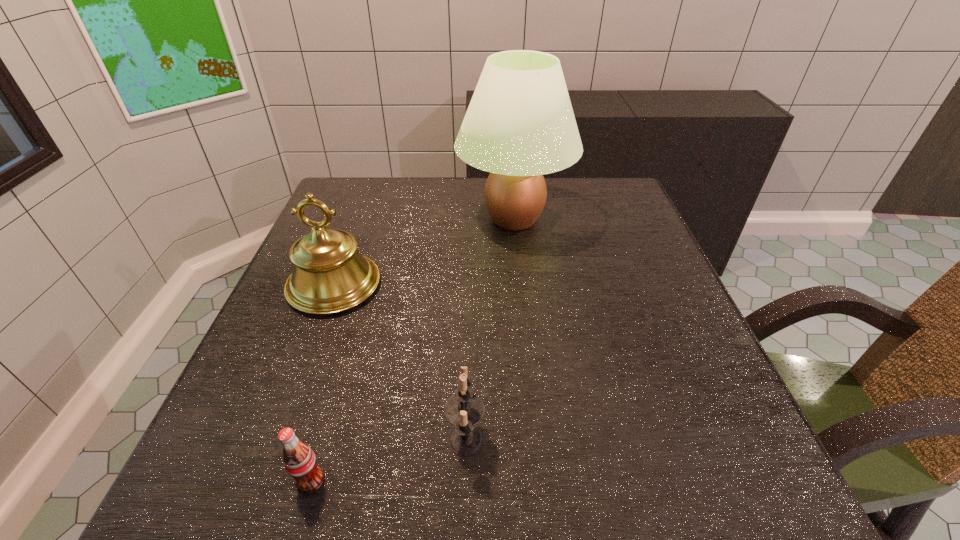
You are a GUI agent. You are given a task and a screenshot of the screen. Output one action in this format:
    pyautogui.click(x=<x>, y=<y>)
    Task: Click on the tallest object
    This screenshot has width=960, height=540.
    Given the screenshot: What is the action you would take?
    pyautogui.click(x=520, y=125)

In order to click on the farthest object in this screenshot , I will do `click(520, 125)`.

I want to click on bell, so click(330, 275).

I want to click on the third nearest object, so click(330, 275).

You are a GUI agent. You are given a task and a screenshot of the screen. Output one action in this format:
    pyautogui.click(x=<x>, y=<y>)
    Task: Click on the second shortest object
    This screenshot has width=960, height=540.
    Given the screenshot: What is the action you would take?
    pyautogui.click(x=463, y=410)

Find the location of `the shortest object`. the shortest object is located at coordinates (299, 460).

At what (x,y) coordinates should I click in order to perform the action: click on free spot located on the shade of the farthest object. Please return your answer as a coordinate pair (x, y). The width and height of the screenshot is (960, 540). Looking at the image, I should click on (372, 219).

The width and height of the screenshot is (960, 540). Identify the location of blank space located 0.070m on the shade of the farthest object. (430, 219).

Where is `free region located 0.270m on the shade of the farthest object`? The image size is (960, 540). free region located 0.270m on the shade of the farthest object is located at coordinates (352, 219).

Image resolution: width=960 pixels, height=540 pixels. Identify the location of free point located on the front of the third nearest object. (299, 382).